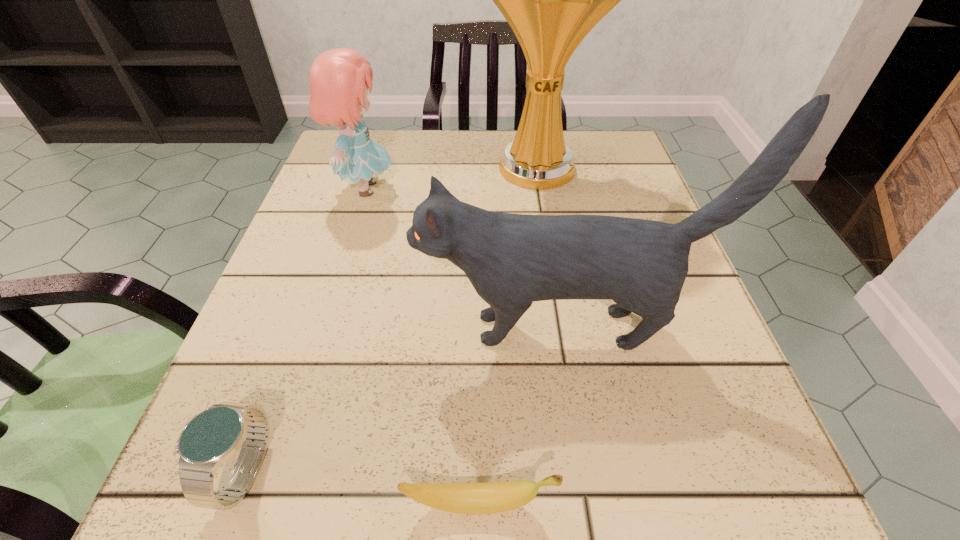
Locate an element on the screen. The height and width of the screenshot is (540, 960). free space that is in between the fourth tallest object and the doll is located at coordinates (305, 330).

Locate an element on the screen. The width and height of the screenshot is (960, 540). free spot between the third shortest object and the trophy_cup is located at coordinates (451, 179).

This screenshot has height=540, width=960. I want to click on free space between the banana and the doll, so click(421, 346).

Locate an element on the screen. Image resolution: width=960 pixels, height=540 pixels. empty space between the banana and the watch is located at coordinates (362, 487).

Locate an element on the screen. This screenshot has width=960, height=540. free spot between the second shortest object and the second tallest object is located at coordinates (404, 400).

The width and height of the screenshot is (960, 540). Identify the location of free space between the cat and the second shortest object. (404, 400).

I want to click on object that can be found as the closest to the banana, so click(x=210, y=438).

Point out which object is positioned as the third nearest to the third shortest object. Please provide its 2D coordinates. Your answer should be formatted as a tuple, i.e. [(x, y)], where the tuple contains the x and y coordinates of a point satisfying the conditions above.

[(210, 438)]

You are a GUI agent. You are given a task and a screenshot of the screen. Output one action in this format:
    pyautogui.click(x=<x>, y=<y>)
    Task: Click on the vacant space that satisfies the following two spatial constraints: 1. at the front of the tallest object where the globe is prominent; 2. on the front-facing side of the doll
    The height and width of the screenshot is (540, 960).
    Given the screenshot: What is the action you would take?
    pyautogui.click(x=540, y=188)